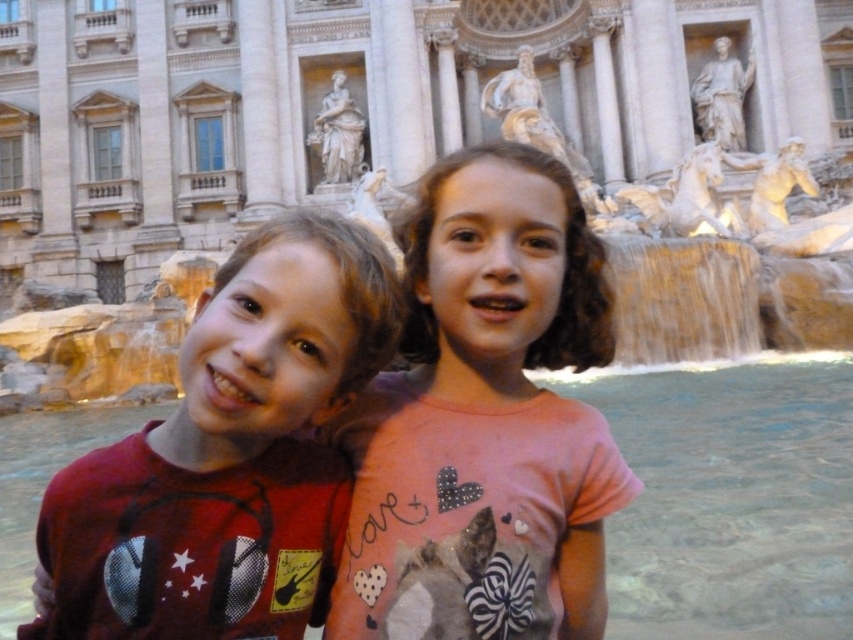
Is point (811, 147) farther from viewer compared to point (397, 326)?

Yes, point (811, 147) is farther from viewer.

Which is more to the right, stone marble palace at center or matte red shirt at center?

matte red shirt at center is more to the right.

Is point (15, 144) less distant than point (372, 360)?

That is False.

This screenshot has height=640, width=853. I want to click on stone marble palace at center, so click(x=361, y=106).

Is stone marble palace at center below pink fabric shirt at center?

Actually, stone marble palace at center is above pink fabric shirt at center.

Who is lower down, stone marble palace at center or pink fabric shirt at center?

pink fabric shirt at center is below.

You are a GUI agent. You are given a task and a screenshot of the screen. Output one action in this format:
    pyautogui.click(x=<x>, y=<y>)
    Task: Click on the stone marble palace at center
    This screenshot has width=853, height=640.
    Given the screenshot: What is the action you would take?
    pyautogui.click(x=361, y=106)

Who is taller, pink fabric shirt at center or matte red shirt at center?

pink fabric shirt at center is taller.

I want to click on pink fabric shirt at center, so click(485, 419).

At what (x,y) coordinates should I click in order to perform the action: click on pink fabric shirt at center. Please return your answer as a coordinate pair (x, y). Looking at the image, I should click on (485, 419).